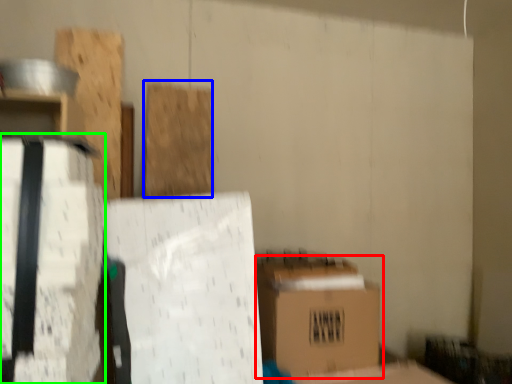
Question: Estimate the real-world distances between objects in this image. Which object is farther from box (highlighted by a red box), wood (highlighted by a blue box) or cardboard box (highlighted by a green box)?

Choices:
 (A) wood
 (B) cardboard box

Answer: (B)